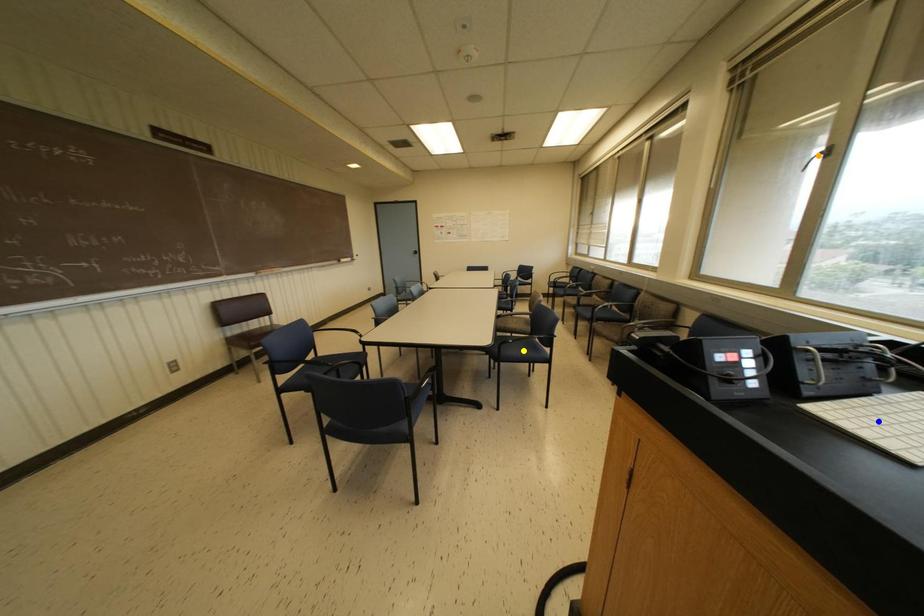
Order these from nearest to farthest:
1. orange point
2. blue point
3. yellow point

blue point < orange point < yellow point